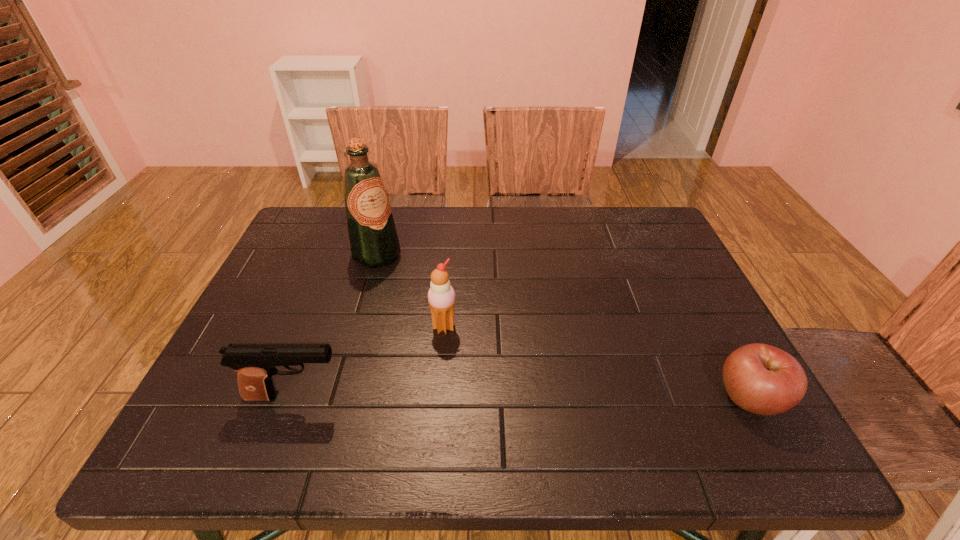
Where is `free space on the desktop that is between the pistol and the apple and is positioned at the front with a straw on the third nearest object`? Image resolution: width=960 pixels, height=540 pixels. free space on the desktop that is between the pistol and the apple and is positioned at the front with a straw on the third nearest object is located at coordinates (514, 397).

Identify the location of vacant spot on the desktop that is between the pistol and the apple and is positioned on the front-facing side of the tallest object. This screenshot has width=960, height=540. click(522, 397).